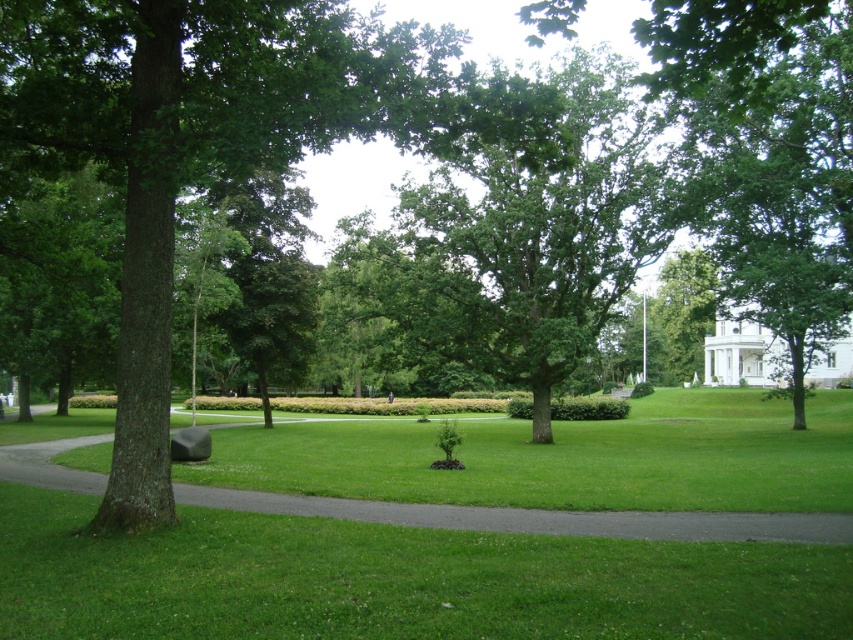
Question: Which point is closer to the camera?

Choices:
 (A) (42, 460)
 (B) (434, 150)

Answer: (B)

Question: Is green leafy tree at center to the right of green grass at lower center from the viewer's perspective?

Choices:
 (A) yes
 (B) no

Answer: (A)

Question: Is green leafy tree at center closer to camera compared to green grass at lower center?

Choices:
 (A) yes
 (B) no

Answer: (B)

Question: Can you confirm if green leafy tree at center is thinner than green grass at lower center?

Choices:
 (A) no
 (B) yes

Answer: (A)